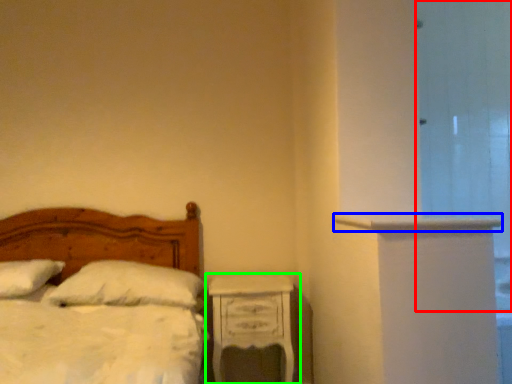
Question: Which is farther away from glass door (highlighted by a red box)? ledge (highlighted by a blue box) or nightstand (highlighted by a green box)?

Choices:
 (A) ledge
 (B) nightstand

Answer: (B)